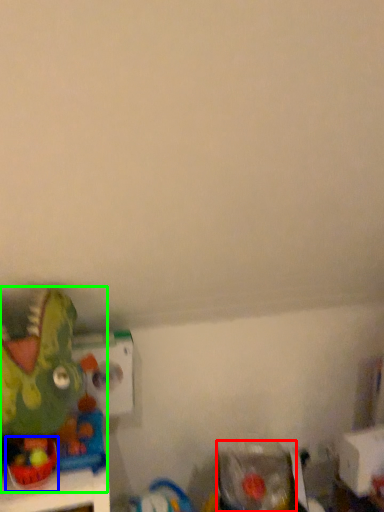
Question: Considering the real-world distances, which object is closest to toy (highlighted by a red box)? toy (highlighted by a blue box) or toy (highlighted by a green box).

Choices:
 (A) toy
 (B) toy

Answer: (B)